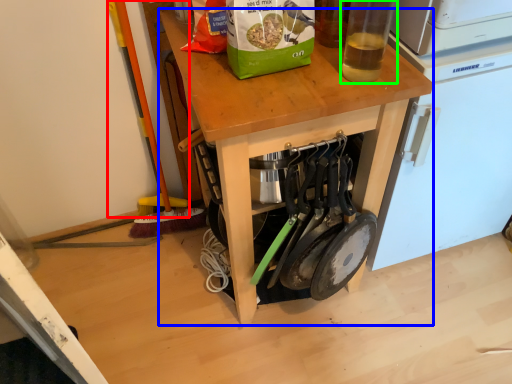
Question: Estimate the real-world distances between objects in this image. Which object is farther from brush (highlighted by a red box), desk (highlighted by a blue box) or bottle (highlighted by a green box)?

Choices:
 (A) desk
 (B) bottle

Answer: (B)